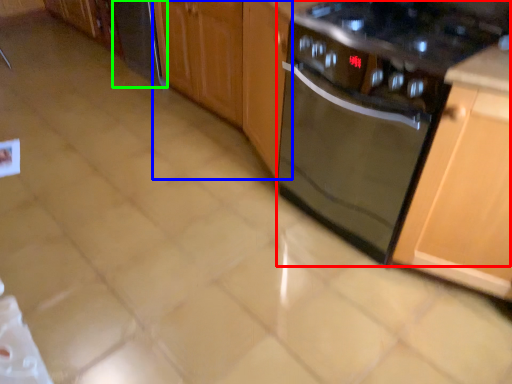
Question: Estimate the real-world distances between objects in this image. Which object is farther from kitchen appliance (highlighted by a red box), cabinetry (highlighted by a blue box) or appliance (highlighted by a green box)?

Choices:
 (A) cabinetry
 (B) appliance

Answer: (B)